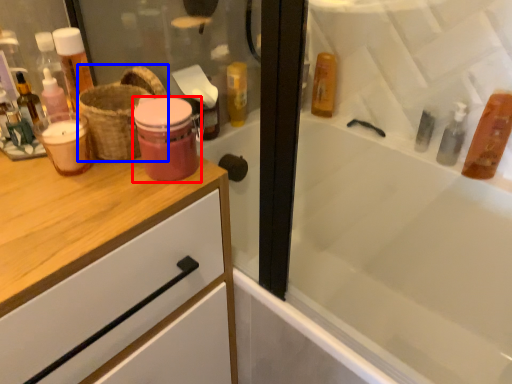
Question: Which object is further to the camera taking this photo, mouthwash (highlighted by a red box) or basket (highlighted by a blue box)?

Choices:
 (A) mouthwash
 (B) basket

Answer: (B)